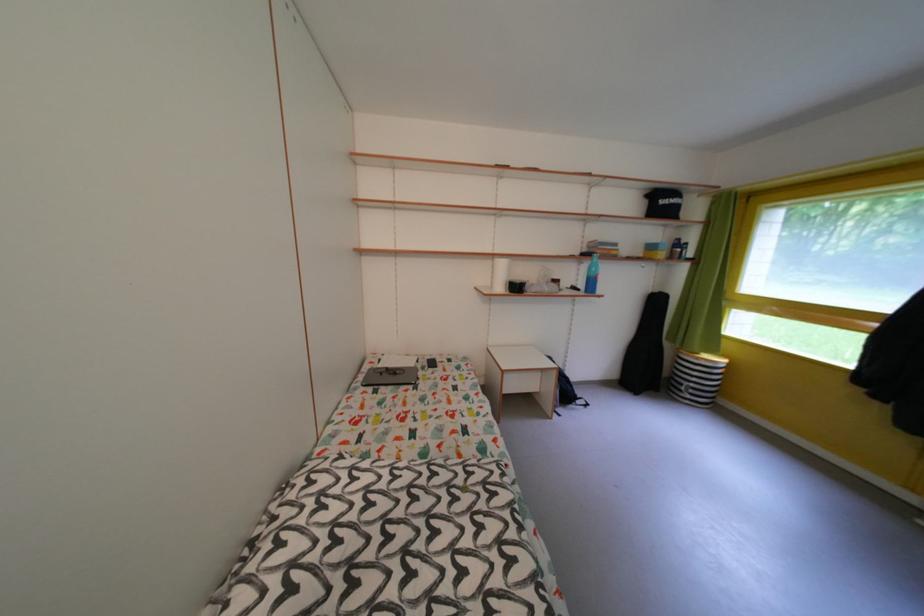
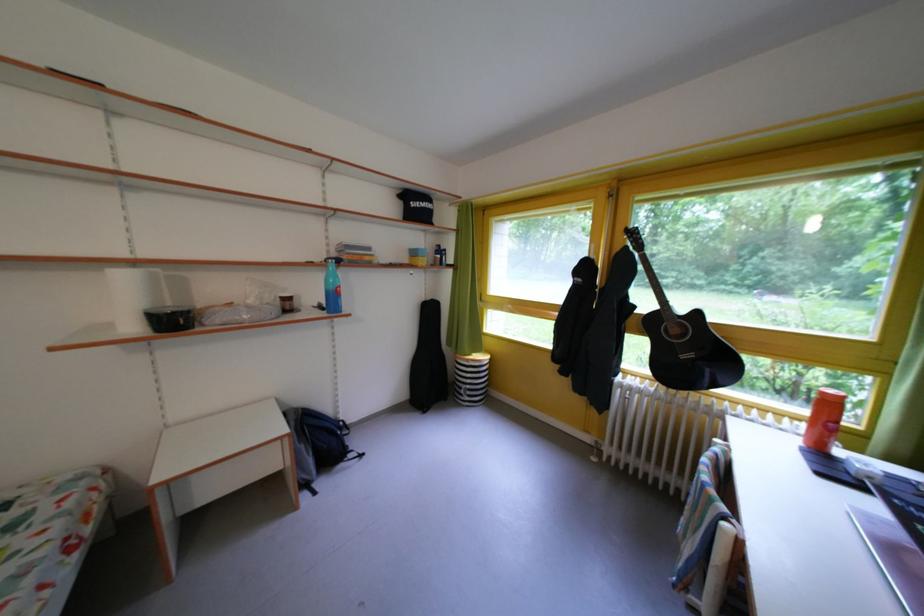
Find the pixel in the second image that matches point 700,391 in the first image.

(478, 392)